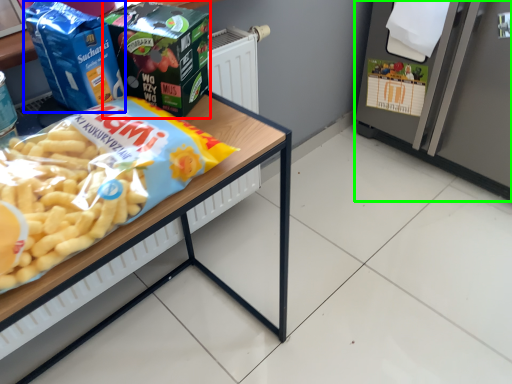
Question: Based on their relative distances, which object is nearer to product (highlighted by a red box)? Choose from product (highlighted by a blue box) and appliance (highlighted by a green box).

Choices:
 (A) product
 (B) appliance

Answer: (A)